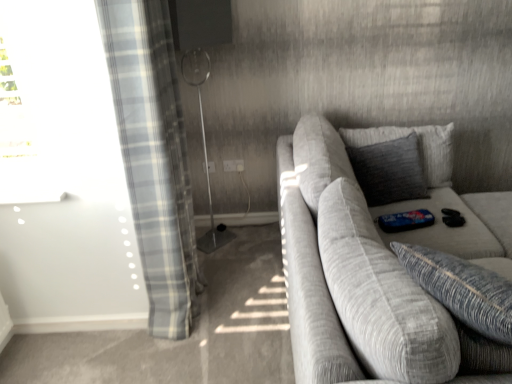
Question: From a real-world perspective, is light blue plaid curtain at left physically located above or below textured gray couch at right?

Choices:
 (A) below
 (B) above

Answer: (B)

Question: Considering the positions of point tap(130, 157) and point tap(449, 238), is point tap(130, 157) closer or farther from the camera than point tap(449, 238)?

Choices:
 (A) closer
 (B) farther

Answer: (A)

Question: Which is nearer to the textured gray pillow at upper right?

Choices:
 (A) textured gray couch at right
 (B) light blue plaid curtain at left

Answer: (A)

Question: Based on their relative distances, which object is nearer to the textured gray pillow at upper right?

Choices:
 (A) light blue plaid curtain at left
 (B) textured gray couch at right

Answer: (B)